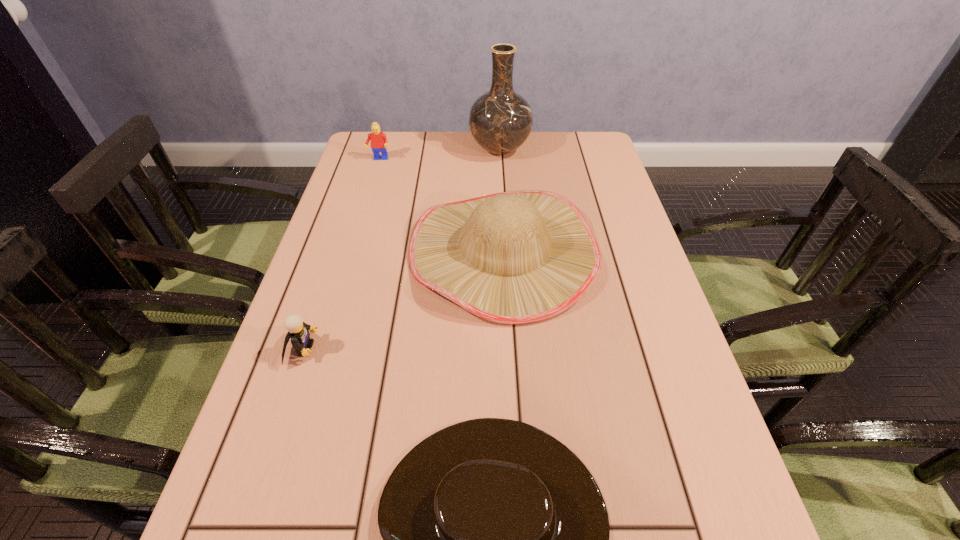
You are a GUI agent. You are given a task and a screenshot of the screen. Output one action in this format:
    pyautogui.click(x=<x>, y=<y>)
    Task: Click on the vase
    The width and height of the screenshot is (960, 540).
    Given the screenshot: What is the action you would take?
    pyautogui.click(x=500, y=120)

The image size is (960, 540). Identify the location of sunhat. (519, 257).

In order to click on the second tallest object in this screenshot , I will do `click(519, 257)`.

Where is `the farther Lego`? the farther Lego is located at coordinates (379, 143).

I want to click on the third tallest object, so click(379, 143).

Identify the location of the second shortest object. Image resolution: width=960 pixels, height=540 pixels. (298, 331).

What are the coordinates of `the shorter Lego` in the screenshot? It's located at (298, 331).

Where is `free space located 0.120m on the right of the tallest object`? This screenshot has width=960, height=540. free space located 0.120m on the right of the tallest object is located at coordinates (567, 149).

Identify the location of vacant space located 0.310m on the back of the third nearest object. (497, 140).

Identify the location of vacant region located on the front-facing side of the farther Lego. The width and height of the screenshot is (960, 540). (361, 220).